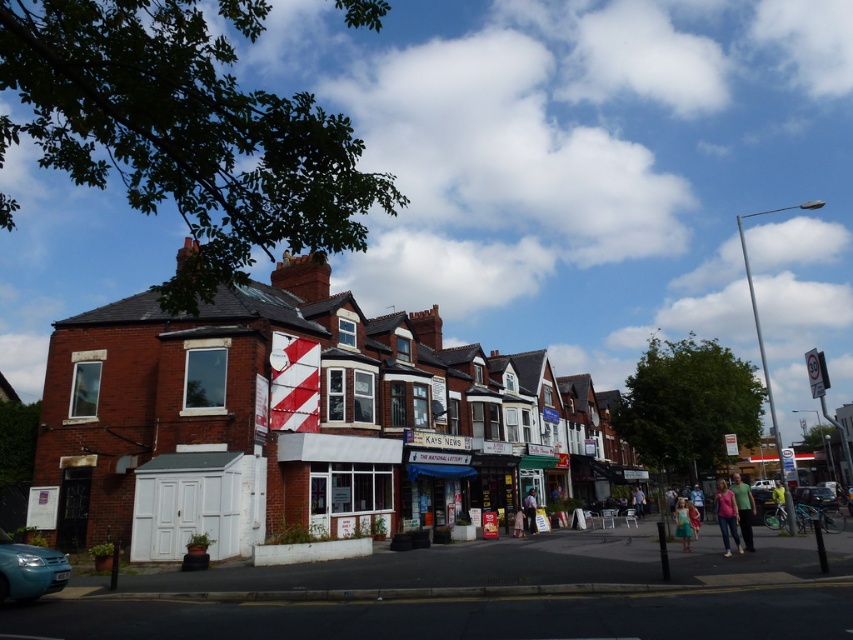
Question: Can you confirm if light blue plastic car at lower left is bigger than pink fabric shirt at lower right?

Choices:
 (A) no
 (B) yes

Answer: (A)

Question: Can you confirm if light blue plastic car at lower left is positioned above yellow fabric jacket at lower right?

Choices:
 (A) yes
 (B) no

Answer: (A)

Question: In this image, where is light blue plastic car at lower left located relative to pink fabric shirt at lower right?

Choices:
 (A) below
 (B) above

Answer: (B)

Question: Which object appears closest to the camera in this image?

Choices:
 (A) light blue denim jeans at lower right
 (B) green cotton shirt at lower right
 (C) metallic silver van at center
 (D) light blue jeans at center

Answer: (B)

Question: Estimate the real-world distances between objects in this image. Which object is farther from the light blue denim jeans at lower right?

Choices:
 (A) pastel pink dress at center
 (B) light blue plastic car at lower left
 (C) red brick building at center

Answer: (B)

Question: Which of these objects is positioned farthest from the pastel pink dress at center?

Choices:
 (A) pink fabric shirt at lower right
 (B) green fabric dress at lower center
 (C) light blue jeans at center
 (D) yellow fabric jacket at lower right

Answer: (D)